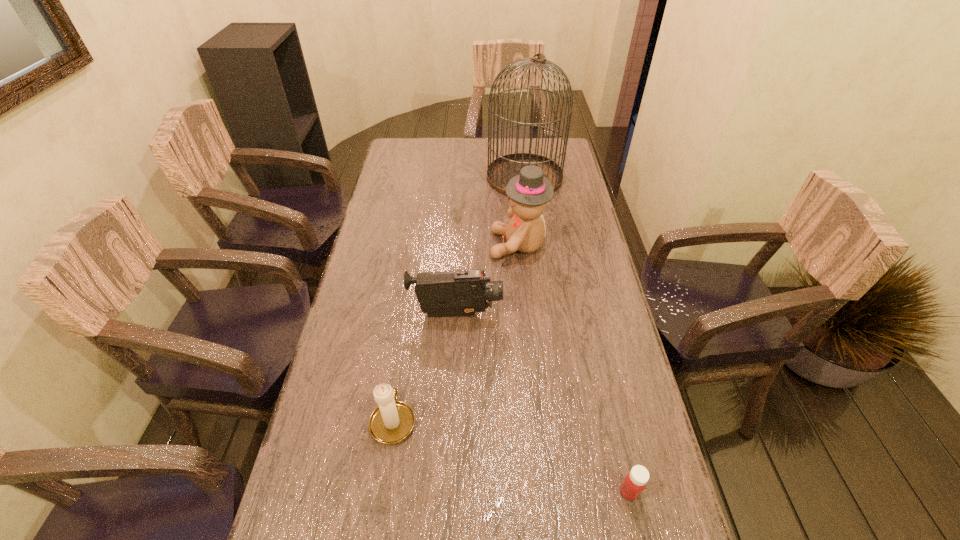
Identify the location of medicine present at the right edge. This screenshot has width=960, height=540. (634, 483).

Identify the location of object at the far right corner. (500, 171).

This screenshot has height=540, width=960. Find the location of `free space at the left edge of the desktop`. free space at the left edge of the desktop is located at coordinates (328, 516).

In the image, there is a desktop. Where is `vacant space at the right edge`? The image size is (960, 540). vacant space at the right edge is located at coordinates (617, 390).

Where is `vacant space at the far left corner`? The image size is (960, 540). vacant space at the far left corner is located at coordinates (412, 166).

Locate an element on the screen. This screenshot has width=960, height=540. free space at the far right corner of the desktop is located at coordinates (540, 153).

You are a GUI agent. You are given a task and a screenshot of the screen. Output one action in this format:
    pyautogui.click(x=<x>, y=<y>)
    Task: Click on the free point between the candle holder and the camcorder
    Image resolution: width=960 pixels, height=540 pixels.
    Given the screenshot: What is the action you would take?
    pyautogui.click(x=424, y=367)

Identify the location of vacant space in between the fourth shortest object and the candle holder. This screenshot has width=960, height=540. (456, 333).

Where is `vacant point located between the fourth nearest object and the nearest object`? This screenshot has width=960, height=540. vacant point located between the fourth nearest object and the nearest object is located at coordinates (574, 368).

I want to click on the fourth closest object to the shortest object, so click(500, 171).